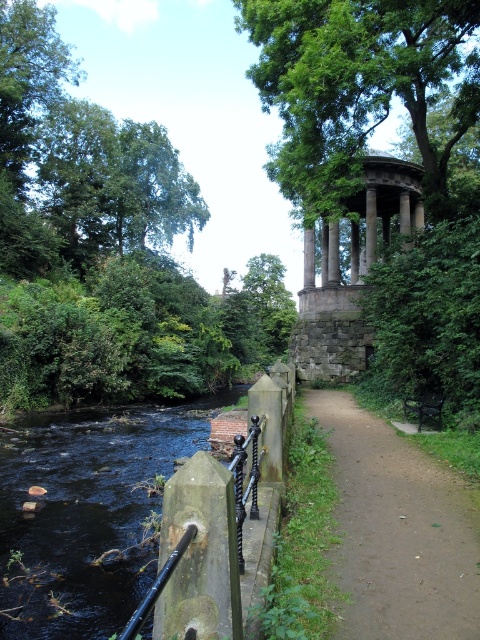
Between point (364, 621) and point (194, 512), which one is positioned behind?

The point (364, 621) is behind.

Can you confirm if brown dirt path at center is taller than green mossy post at center?

Incorrect, brown dirt path at center's height is not larger of green mossy post at center's.

Describe the element at coordinates (396, 531) in the screenshot. I see `brown dirt path at center` at that location.

Identify the location of brown dirt path at center. (396, 531).

Is brown dirt path at center above black metal rail at lower left?

Incorrect, brown dirt path at center is not positioned above black metal rail at lower left.

Can you confirm if brown dirt path at center is positioned to the left of black metal rail at lower left?

Incorrect, brown dirt path at center is not on the left side of black metal rail at lower left.

The image size is (480, 640). I want to click on brown dirt path at center, so click(396, 531).

In the scene shown: Does green mossy post at center have a greater width compared to black metal rail at lower left?

Correct, the width of green mossy post at center exceeds that of black metal rail at lower left.

Does green mossy post at center come in front of black metal rail at lower left?

No, it is behind black metal rail at lower left.

Between point (237, 608) and point (132, 634), which one is positioned behind?

Point (237, 608)

I want to click on green mossy post at center, so click(x=200, y=554).